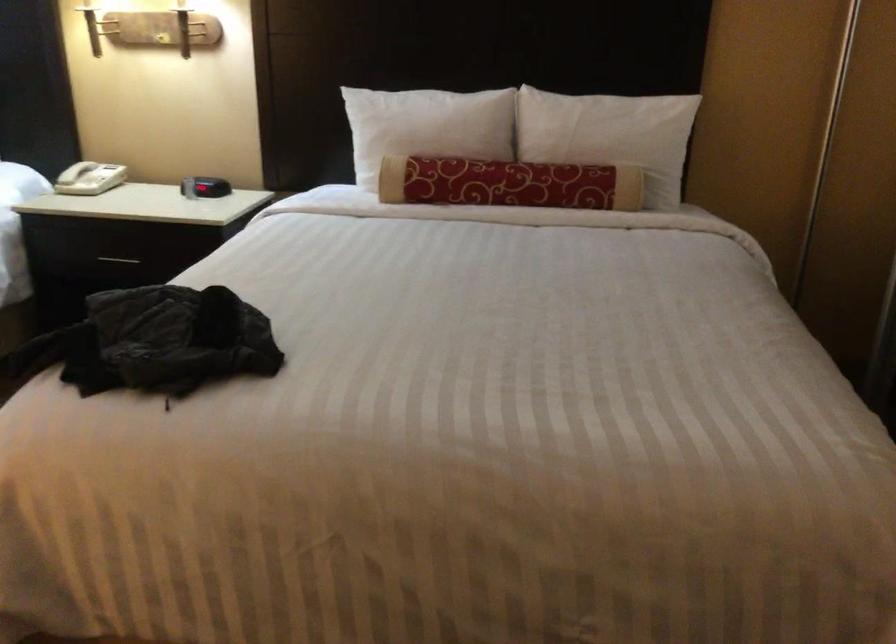
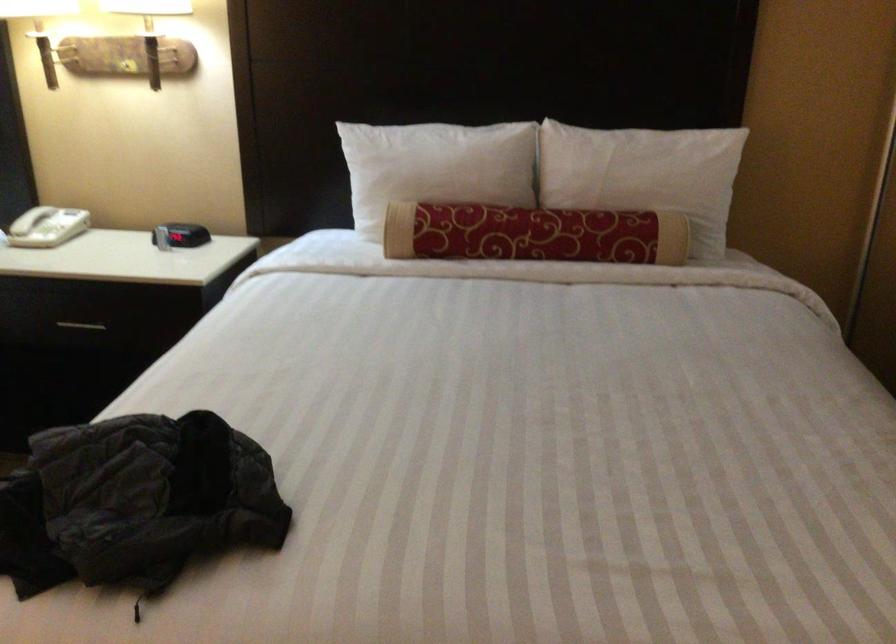
Find the pixel in the second image that matches [425,124] in the first image.

(435, 167)